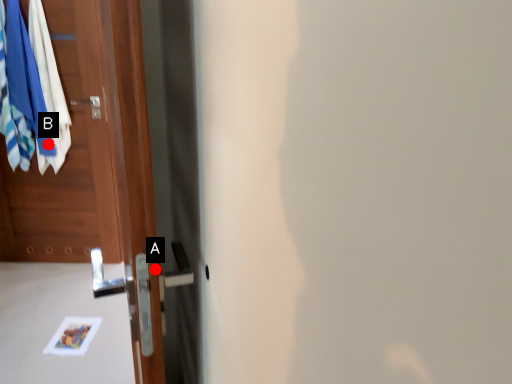
Question: Two points are circled on the image, labeled by A and B beside each circle. Among these points, which one is farthest from the camera?

Choices:
 (A) A is further
 (B) B is further

Answer: (B)